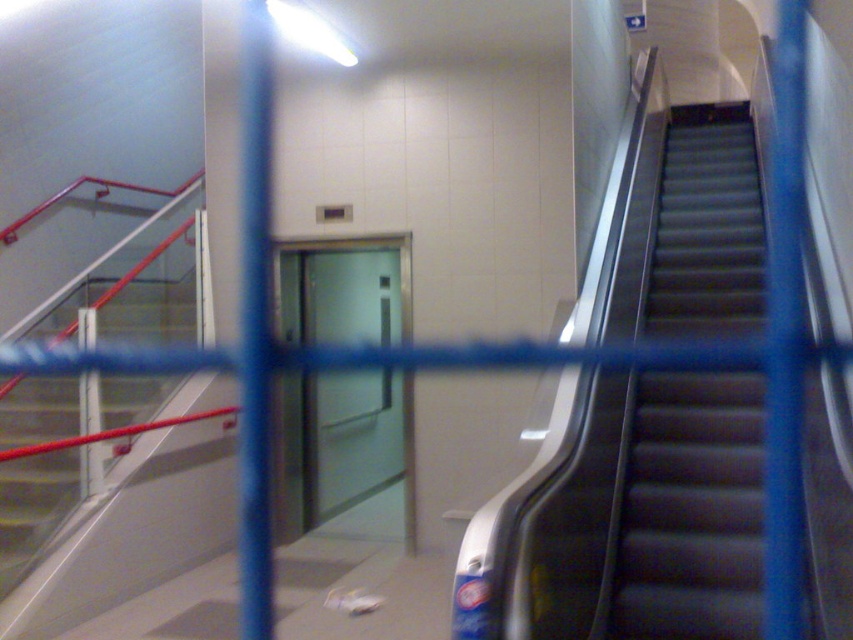
Is metallic gray escalator at right positioned in front of transparent glass elevator at center?

That is True.

Is point (756, 509) closer to viewer compared to point (344, 243)?

Yes, point (756, 509) is closer to viewer.

Who is more forward, (688,385) or (305,461)?

Positioned in front is point (688,385).

Identify the location of metallic gray escalator at right. The image size is (853, 640). (689, 509).

Does transparent glass elevator at center appear on the left side of metallic gray stairs at left?

Incorrect, transparent glass elevator at center is not on the left side of metallic gray stairs at left.

Which is more to the left, transparent glass elevator at center or metallic gray stairs at left?

Positioned to the left is metallic gray stairs at left.

Locate an element on the screen. transparent glass elevator at center is located at coordinates (338, 442).

Is point (740, 300) positioned before point (171, 378)?

That is False.

Which of these two, metallic gray escalator at right or metallic gray stairs at left, stands shorter?

With less height is metallic gray stairs at left.

This screenshot has width=853, height=640. I want to click on metallic gray escalator at right, so click(689, 509).